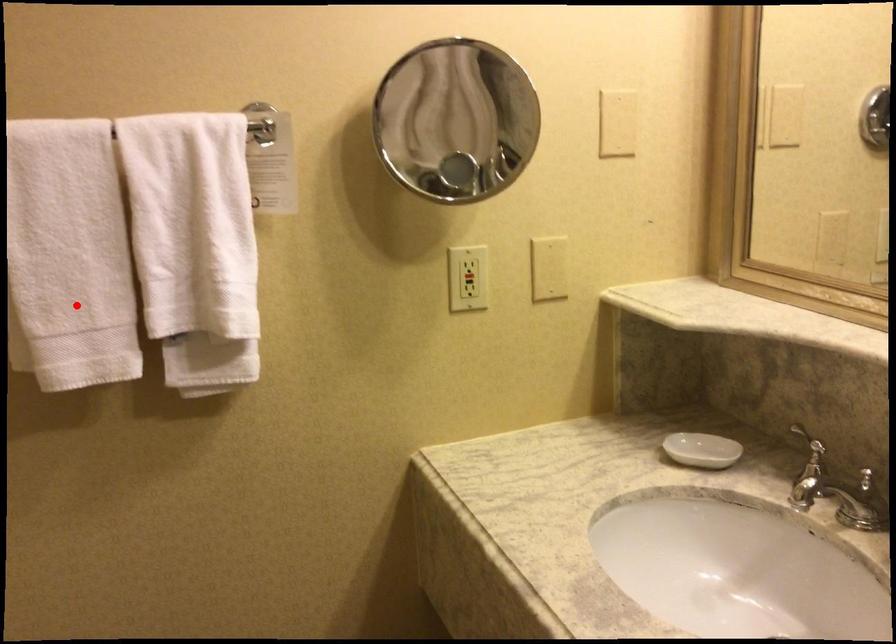
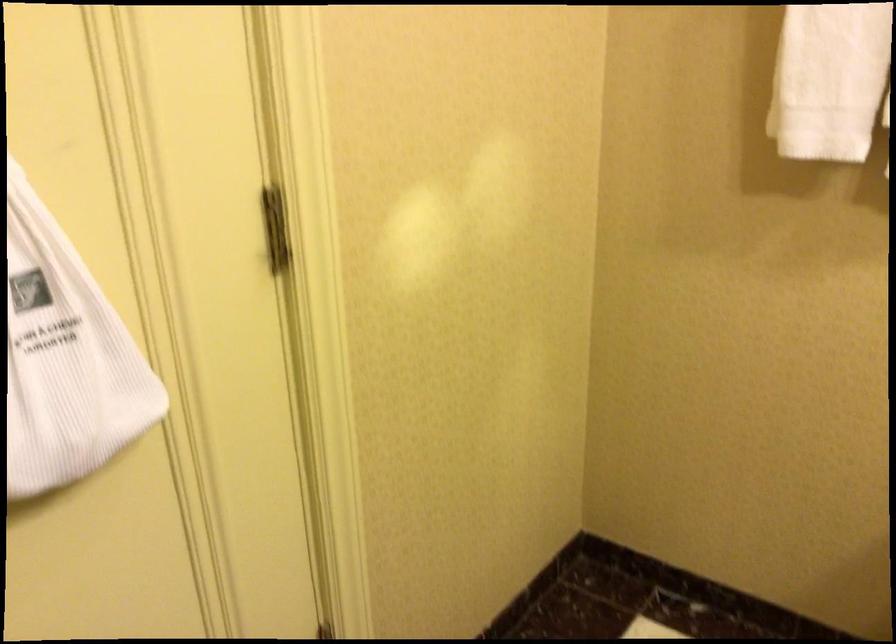
In the second image, find the point that corresponds to the highlighted location in the first image.

(830, 80)